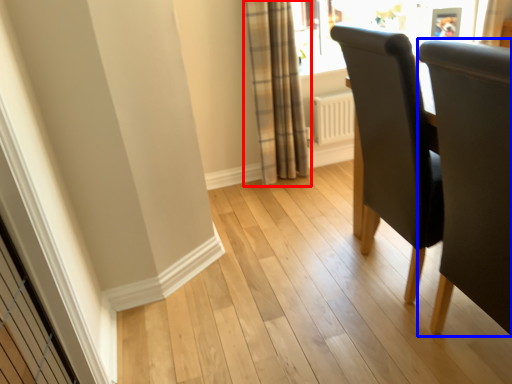
Question: Which object is further to the camera taking this photo, curtain (highlighted by a red box) or chair (highlighted by a blue box)?

Choices:
 (A) curtain
 (B) chair

Answer: (A)